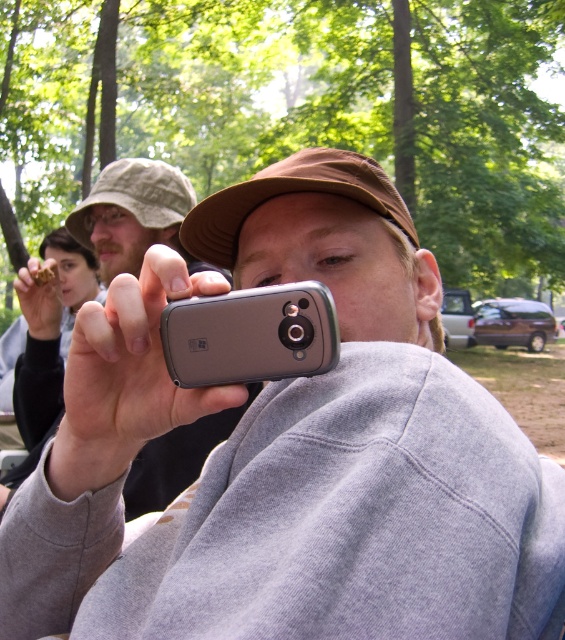
You are trying to decide which device to use for taking a quick photo. The silver metallic phone at center and the silver metallic smartphone at center are both available. Based on their sizes, which one might be easier to hold and operate with one hand?

The silver metallic smartphone at center is narrower than the silver metallic phone at center, so it might be easier to hold and operate with one hand since it has a smaller width.

You are trying to decide which device to use to take a photo. The silver metallic phone at center has a circular camera lens, while the silver metallic smartphone at center has a rectangular one. Considering their sizes, which device might be easier to hold steady while taking a photo?

The silver metallic phone at center is larger in size than the silver metallic smartphone at center, so it might be easier to hold steady due to its bigger size providing better grip.

You are a photographer trying to capture a group photo of the two people at the center. The silver metallic phone at center and the silver metallic smartphone at center are blocking the view. What is the minimum distance you need to move backward to ensure both devices are fully visible in your camera frame?

The silver metallic phone at center is 32.27 inches from the silver metallic smartphone at center. To ensure both devices are fully visible, you need to move backward until the distance between them in your frame is at least 32.27 inches.